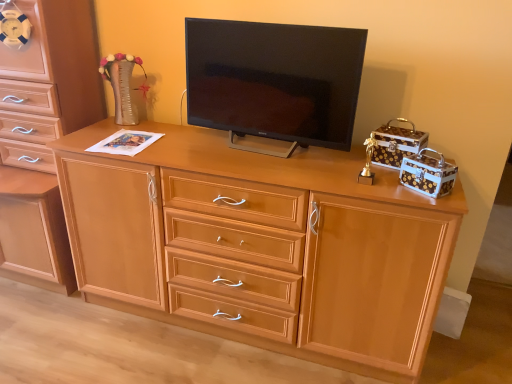
The height and width of the screenshot is (384, 512). Find the location of `free space in front of matte black tv at center`. free space in front of matte black tv at center is located at coordinates (283, 168).